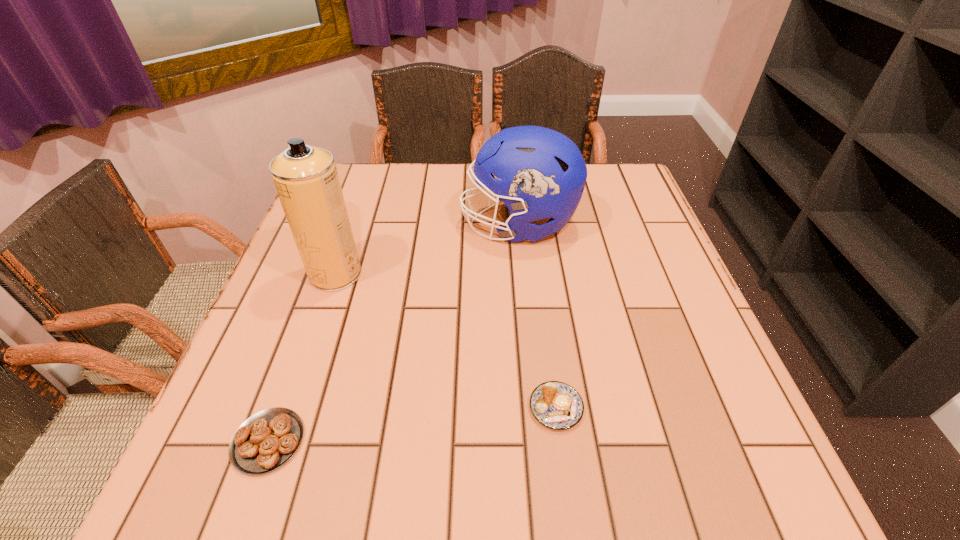
Identify the location of the second farthest object. The height and width of the screenshot is (540, 960). (306, 179).

Find the location of a particular element. Image resolution: width=960 pixels, height=540 pixels. aerosol can is located at coordinates (306, 179).

Locate an element on the screen. football helmet is located at coordinates (543, 174).

Where is `the third shortest object`? Image resolution: width=960 pixels, height=540 pixels. the third shortest object is located at coordinates (543, 174).

You are a GUI agent. You are given a task and a screenshot of the screen. Output one action in this format:
    pyautogui.click(x=<x>, y=<y>)
    Task: Click on the right pastry
    The width and height of the screenshot is (960, 540).
    Given the screenshot: What is the action you would take?
    pyautogui.click(x=556, y=405)

This screenshot has width=960, height=540. Identify the location of the left pastry. (265, 441).

The height and width of the screenshot is (540, 960). Find the location of `free space located on the front of the aerosol can`. free space located on the front of the aerosol can is located at coordinates (321, 317).

I want to click on free space located on the front-facing side of the farthest object, so click(x=341, y=225).

Where is `free spot located 0.270m on the front-facing side of the farthest object`? The height and width of the screenshot is (540, 960). free spot located 0.270m on the front-facing side of the farthest object is located at coordinates (352, 225).

Identify the location of free space located on the front-facing side of the farthest object. (389, 225).